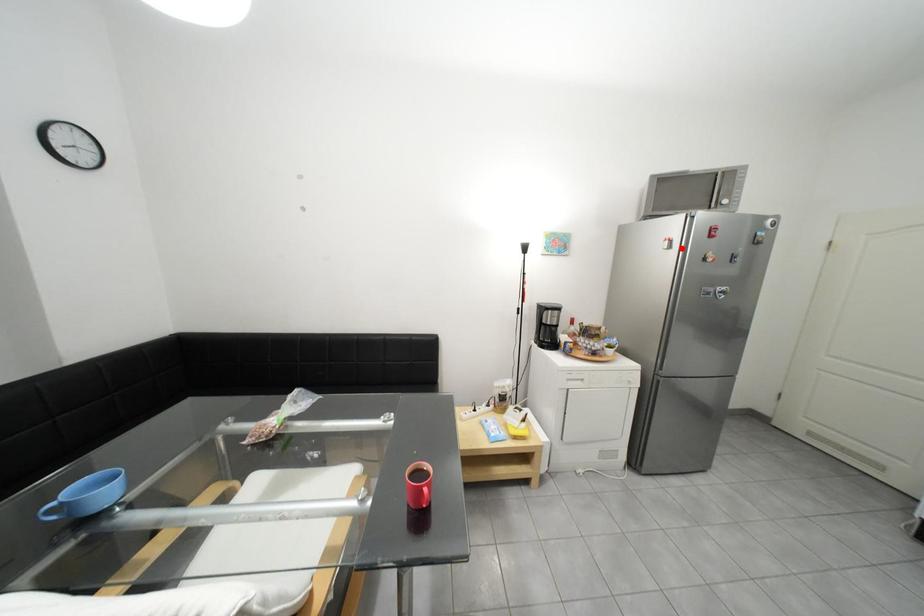
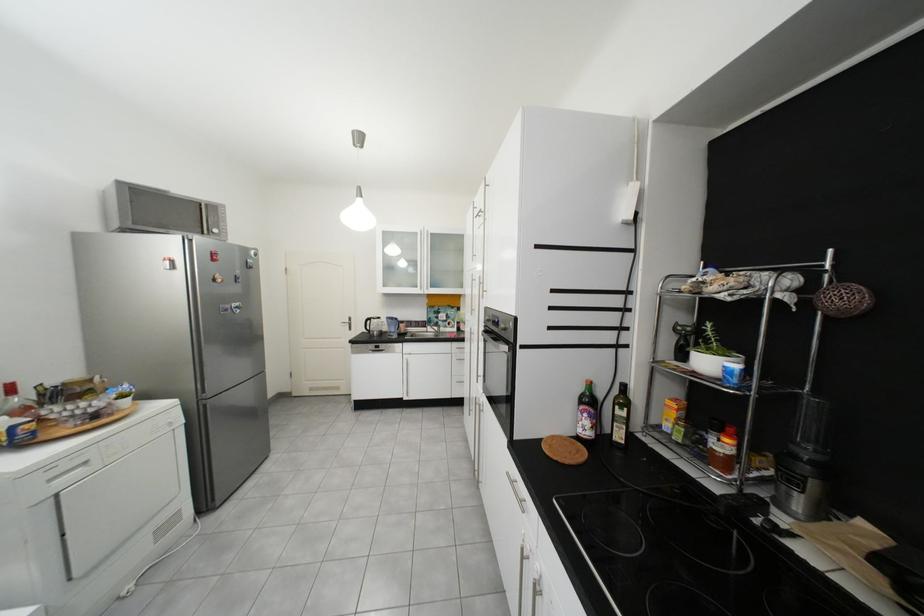
In the second image, find the point that corresponds to the highlighted location in the first image.

(185, 269)